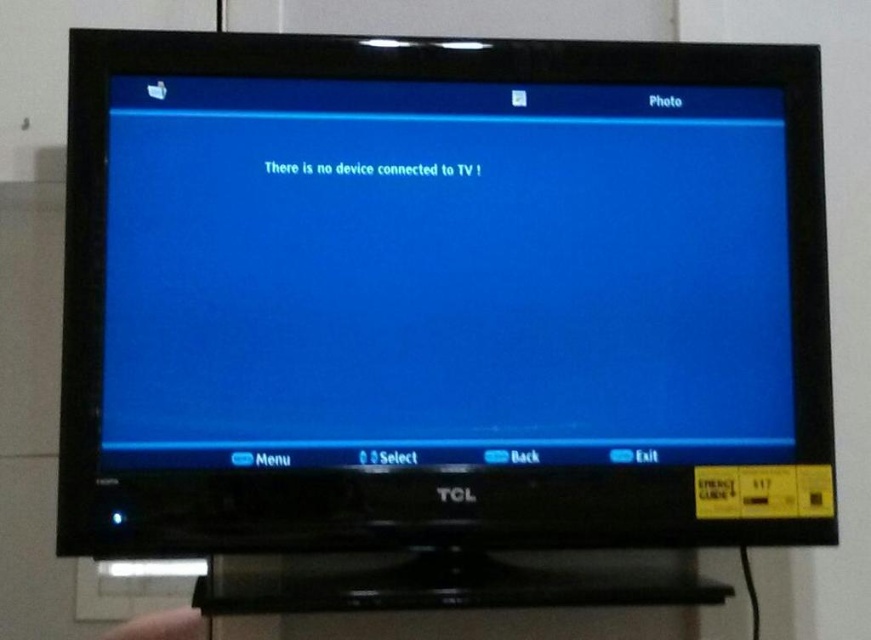
Does point (549, 316) come closer to viewer compared to point (109, 634)?

Yes, it is in front of point (109, 634).

Image resolution: width=871 pixels, height=640 pixels. I want to click on blue glossy screen at center, so click(x=443, y=275).

Between point (362, 428) and point (109, 634), which one is positioned in front?

Positioned in front is point (362, 428).

You are a GUI agent. You are given a task and a screenshot of the screen. Output one action in this format:
    pyautogui.click(x=<x>, y=<y>)
    Task: Click on the blue glossy screen at center
    
    Given the screenshot: What is the action you would take?
    pyautogui.click(x=443, y=275)